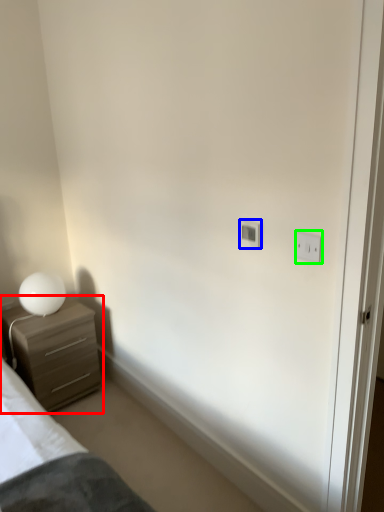
Question: Which is farther away from chest of drawers (highlighted by a red box)? light switch (highlighted by a blue box) or light switch (highlighted by a green box)?

Choices:
 (A) light switch
 (B) light switch

Answer: (B)